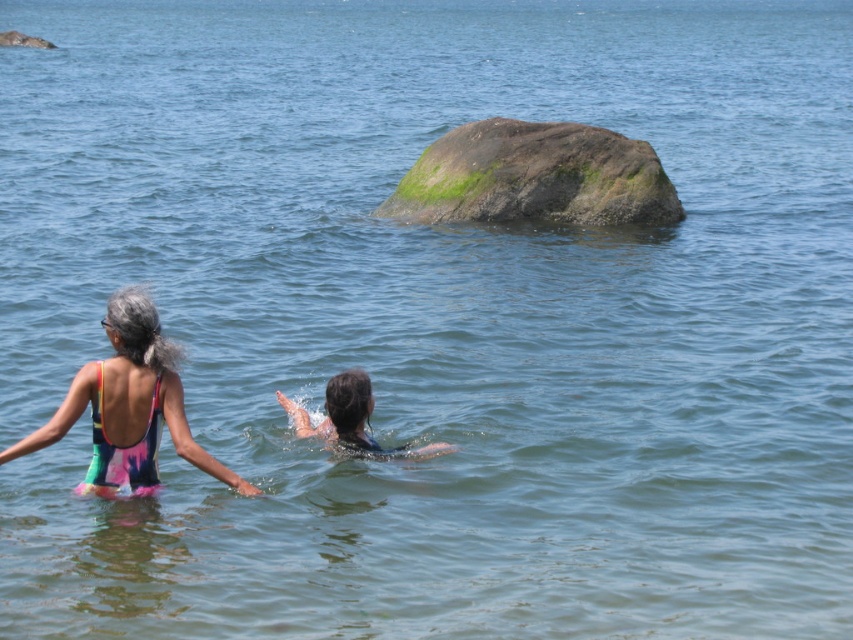
Question: Among these points, which one is nearest to the camera?

Choices:
 (A) (70, 401)
 (B) (517, 204)

Answer: (A)

Question: Where is multicolored fabric swimsuit at left located in relation to dark blue swimsuit at center in the image?

Choices:
 (A) below
 (B) above

Answer: (A)

Question: Estimate the real-world distances between objects in this image. Which object is closer to the green mossy rock at center?

Choices:
 (A) multicolored swimsuit at left
 (B) green mossy rock at upper left
 (C) multicolored fabric swimsuit at left
 (D) dark blue swimsuit at center

Answer: (D)

Question: Can you confirm if multicolored fabric swimsuit at left is positioned to the left of green mossy rock at upper left?

Choices:
 (A) no
 (B) yes

Answer: (A)

Question: Is green mossy rock at center to the left of multicolored fabric swimsuit at left from the viewer's perspective?

Choices:
 (A) no
 (B) yes

Answer: (A)

Question: Which point appears closest to the camera in this image?

Choices:
 (A) (433, 160)
 (B) (173, 445)
 (C) (357, 384)

Answer: (B)